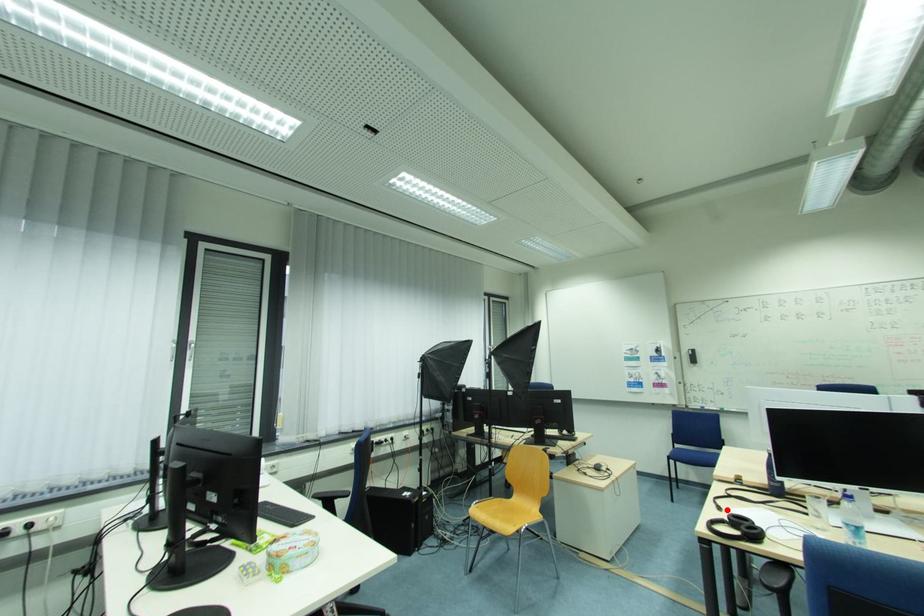
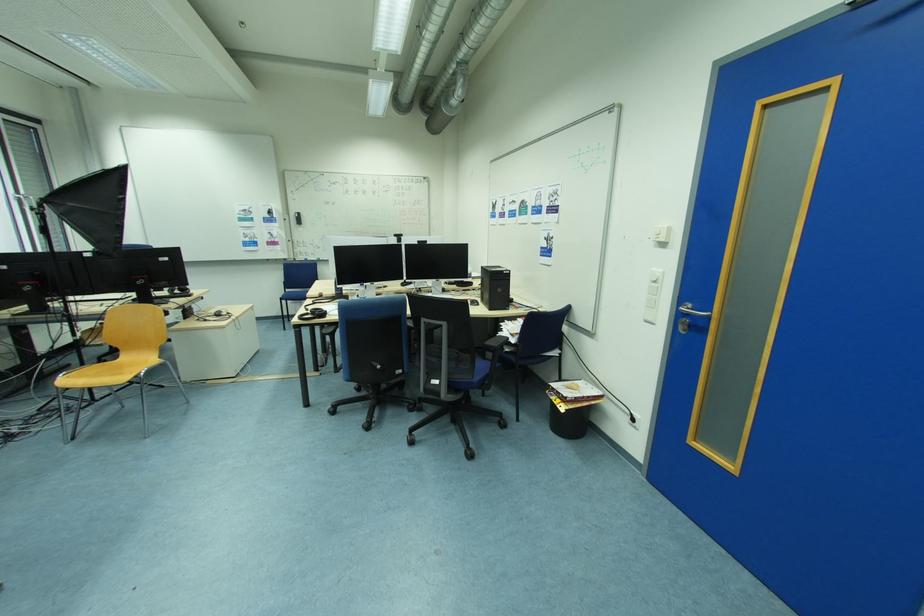
In the second image, find the point that corresponds to the highlighted location in the first image.

(313, 310)